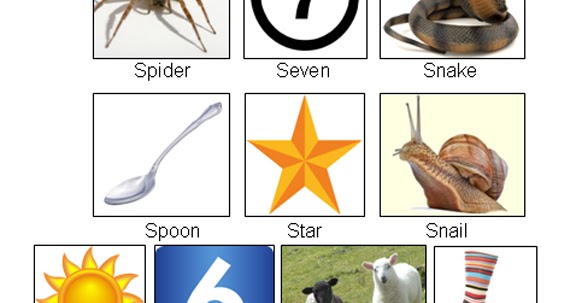
At what (x,y) coordinates should I click in order to perform the action: click on spoon. Please return your answer as a coordinate pair (x, y). This screenshot has width=576, height=303. Looking at the image, I should click on (156, 178).